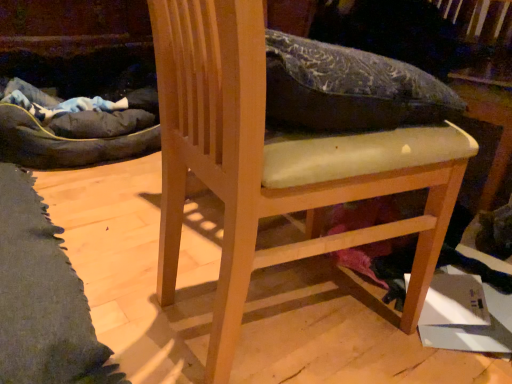
What are the coordinates of `vacant region under light wood chair at center (from a real-world perspective)` in the screenshot? It's located at pyautogui.click(x=288, y=315).